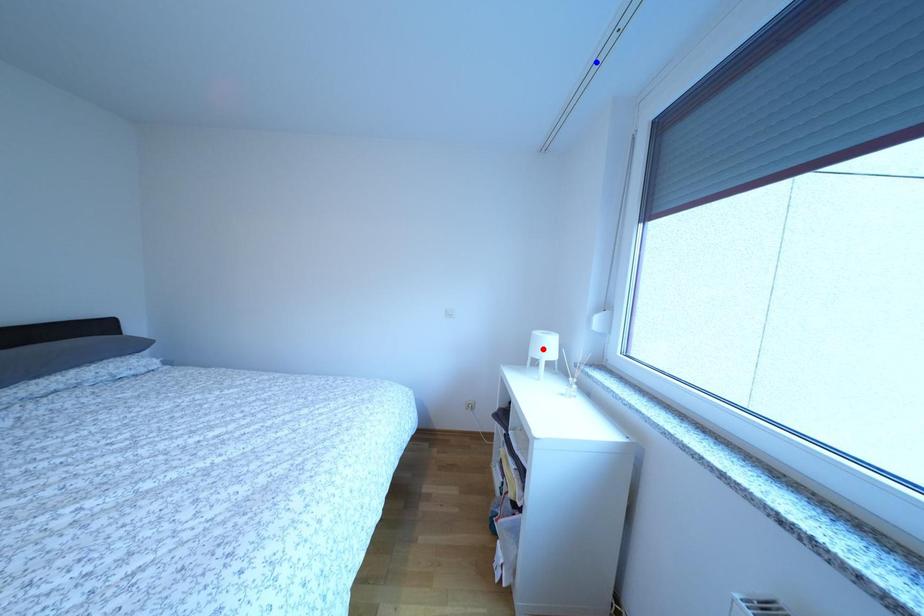
Question: Which of the two points in the image is closer to the camera?

Choices:
 (A) Blue point is closer.
 (B) Red point is closer.

Answer: (A)